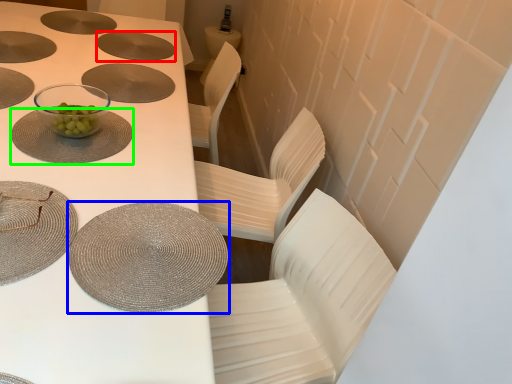
Question: Estimate the real-world distances between objects in this image. Which object is farther from tableware (highlighted by a red box), tableware (highlighted by a blue box) or tableware (highlighted by a green box)?

Choices:
 (A) tableware
 (B) tableware

Answer: (A)